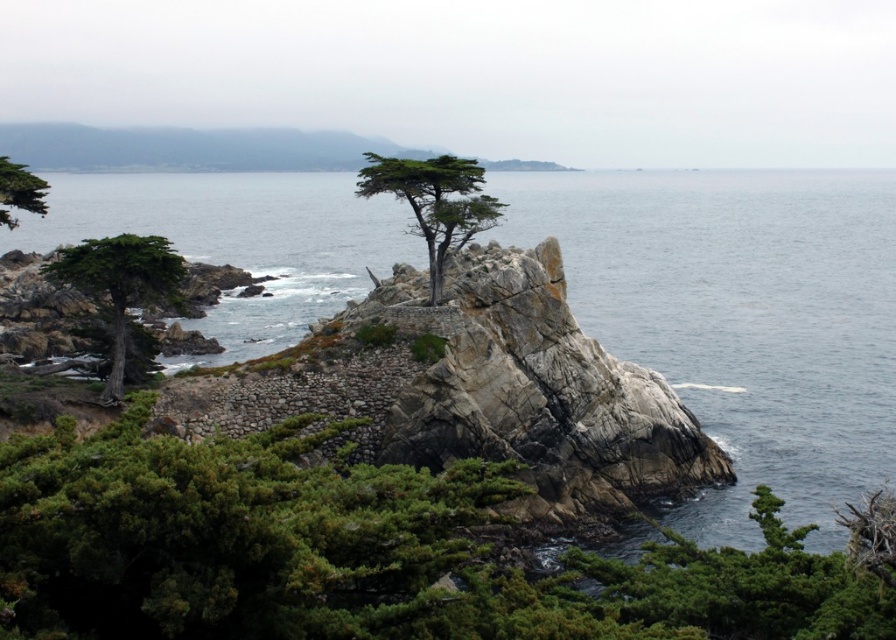
Who is positioned more to the right, clear blue water at center or green matte tree at upper left?

From the viewer's perspective, clear blue water at center appears more on the right side.

From the picture: Measure the distance between point (x=260, y=216) and camera.

They are 246.00 meters apart.

This screenshot has height=640, width=896. What are the coordinates of `clear blue water at center` in the screenshot? It's located at (742, 307).

Does point (808, 321) come closer to viewer compared to point (147, 280)?

That is False.

Does clear blue water at center have a smaller size compared to green matte tree at left?

No.

This screenshot has width=896, height=640. In order to click on clear blue water at center in this screenshot , I will do `click(742, 307)`.

The width and height of the screenshot is (896, 640). What are the coordinates of `clear blue water at center` in the screenshot? It's located at (742, 307).

From the picture: Does green textured tree at center have a larger size compared to green matte tree at upper left?

No.

In order to click on green textured tree at center in this screenshot , I will do `click(434, 202)`.

Who is more distant from viewer, (416, 161) or (19, 173)?

The point (416, 161) is behind.

Locate an element on the screen. green textured tree at center is located at coordinates (434, 202).